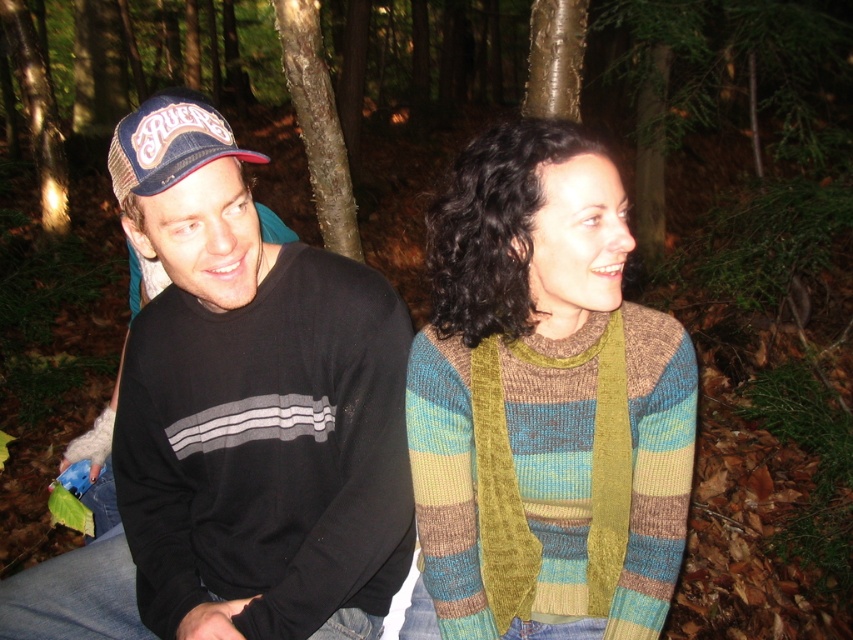
Question: Can you confirm if knitted wool sweater at center is thinner than blue mesh baseball cap at left?

Choices:
 (A) yes
 (B) no

Answer: (B)

Question: Which point is farther from the camera taking this photo?

Choices:
 (A) (442, 612)
 (B) (161, 112)

Answer: (A)

Question: Which object is closer to the camera taking this photo?

Choices:
 (A) black cotton sweatshirt at left
 (B) blue mesh baseball cap at left
 (C) knitted wool sweater at center

Answer: (B)

Question: Which point is farther to the camera?

Choices:
 (A) blue mesh baseball cap at left
 (B) knitted wool sweater at center

Answer: (B)

Question: From the image, what is the correct spatial relationship of knitted wool sweater at center in relation to blue mesh baseball cap at left?

Choices:
 (A) above
 (B) below

Answer: (B)

Question: Can you confirm if black cotton sweatshirt at left is thinner than knitted wool sweater at center?

Choices:
 (A) yes
 (B) no

Answer: (B)